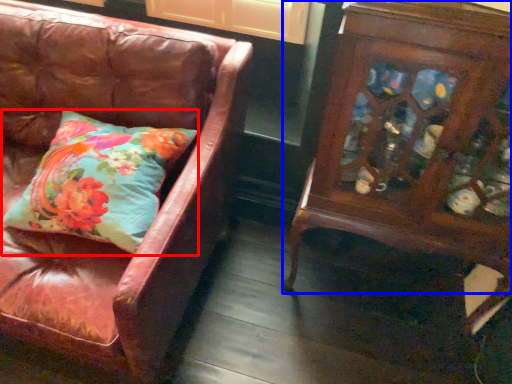
Question: Among these objects, which one is farthest to the camera, pillow (highlighted by a red box) or furniture (highlighted by a blue box)?

Choices:
 (A) pillow
 (B) furniture

Answer: (A)